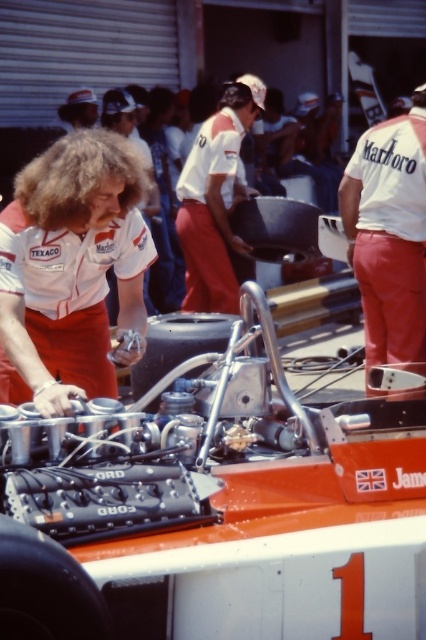
Question: Can you confirm if orange metallic race car at center is smaller than white fabric marlboro shirt at center?

Choices:
 (A) yes
 (B) no

Answer: (B)

Question: Does white fabric marlboro shirt at center appear over white matte shirt at center?

Choices:
 (A) no
 (B) yes

Answer: (A)

Question: Which is farther from the white matte shirt at center?

Choices:
 (A) orange metallic race car at center
 (B) white fabric marlboro shirt at center

Answer: (A)

Question: Based on their relative distances, which object is nearer to the orange metallic race car at center?

Choices:
 (A) white matte shirt at center
 (B) white fabric marlboro shirt at center

Answer: (B)

Question: Among these objects, which one is farthest from the camera?

Choices:
 (A) white matte shirt at center
 (B) orange metallic race car at center
 (C) white fabric marlboro shirt at center

Answer: (A)

Question: Can you confirm if orange metallic race car at center is positioned above white fabric marlboro shirt at center?

Choices:
 (A) yes
 (B) no

Answer: (B)